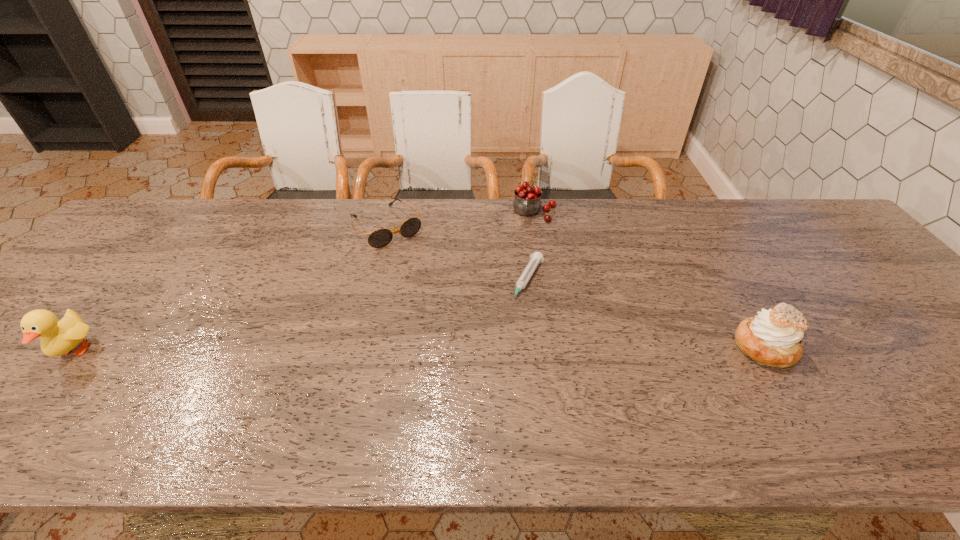
Locate an element on the screen. The image size is (960, 540). free space on the desktop that is between the duckling and the pastry and is positioned on the front-facing side of the fourth object from right to left is located at coordinates (486, 349).

Image resolution: width=960 pixels, height=540 pixels. What are the coordinates of `free space on the desktop that is between the duckling and the pastry and is positioned on the handle side of the pot filled with cherries` in the screenshot? It's located at (502, 349).

Where is `free spot on the desktop that is between the duckling and the pastry and is positioned at the needle end of the shortest object`? This screenshot has width=960, height=540. free spot on the desktop that is between the duckling and the pastry and is positioned at the needle end of the shortest object is located at coordinates (488, 349).